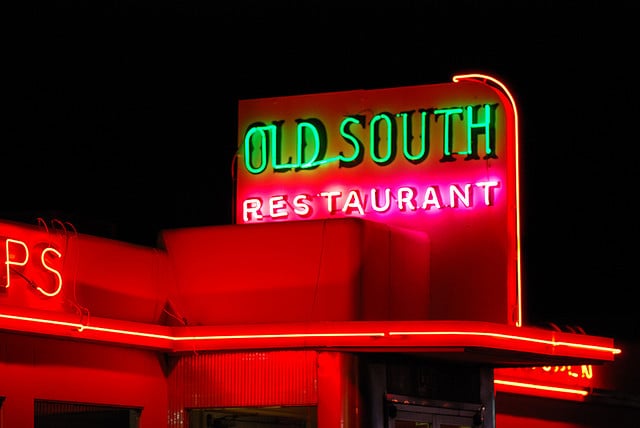
Where is `neon red lettering "restaurant"`? The width and height of the screenshot is (640, 428). neon red lettering "restaurant" is located at coordinates (249, 209), (275, 208), (299, 206), (340, 205), (400, 201), (436, 195), (458, 198), (484, 197).